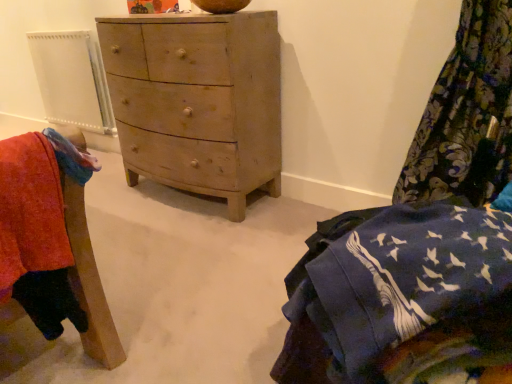
Question: From the image's perspective, does floral fabric curtain at right appear lower than wooden chair at lower left?

Choices:
 (A) yes
 (B) no

Answer: (B)

Question: Does floral fabric curtain at right have a lesser width compared to wooden chair at lower left?

Choices:
 (A) no
 (B) yes

Answer: (A)

Question: Considering the relative sizes of floral fabric curtain at right and wooden chair at lower left in the image provided, is floral fabric curtain at right bigger than wooden chair at lower left?

Choices:
 (A) no
 (B) yes

Answer: (B)

Question: Can you confirm if floral fabric curtain at right is wider than wooden chair at lower left?

Choices:
 (A) yes
 (B) no

Answer: (A)

Question: Does floral fabric curtain at right lie in front of wooden chair at lower left?

Choices:
 (A) yes
 (B) no

Answer: (B)

Question: Can you confirm if floral fabric curtain at right is taller than wooden chair at lower left?

Choices:
 (A) yes
 (B) no

Answer: (A)

Question: From a real-world perspective, is wooden chair at lower left located beneath blue cotton blanket at lower right?

Choices:
 (A) no
 (B) yes

Answer: (A)

Question: Is wooden chair at lower left aimed at blue cotton blanket at lower right?

Choices:
 (A) yes
 (B) no

Answer: (A)

Question: Considering the relative sizes of wooden chair at lower left and blue cotton blanket at lower right in the image provided, is wooden chair at lower left smaller than blue cotton blanket at lower right?

Choices:
 (A) yes
 (B) no

Answer: (A)

Question: From a real-world perspective, is wooden chair at lower left on blue cotton blanket at lower right?

Choices:
 (A) yes
 (B) no

Answer: (A)

Question: From the image's perspective, is wooden chair at lower left under blue cotton blanket at lower right?

Choices:
 (A) no
 (B) yes

Answer: (A)

Question: Considering the relative positions of wooden chair at lower left and blue cotton blanket at lower right in the image provided, is wooden chair at lower left to the left of blue cotton blanket at lower right from the viewer's perspective?

Choices:
 (A) no
 (B) yes

Answer: (B)

Question: Does blue cotton blanket at lower right have a lesser height compared to wooden chair at lower left?

Choices:
 (A) no
 (B) yes

Answer: (A)